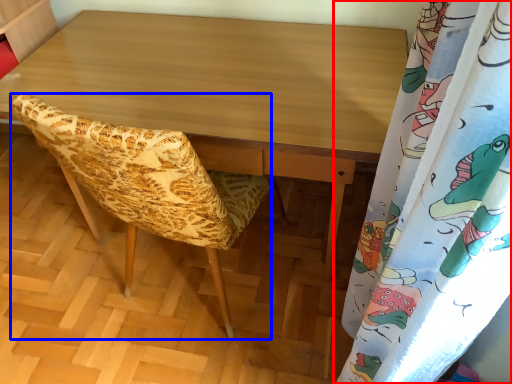
Question: Which point is further to the camera, curtain (highlighted by a red box) or furniture (highlighted by a blue box)?

Choices:
 (A) curtain
 (B) furniture

Answer: (B)